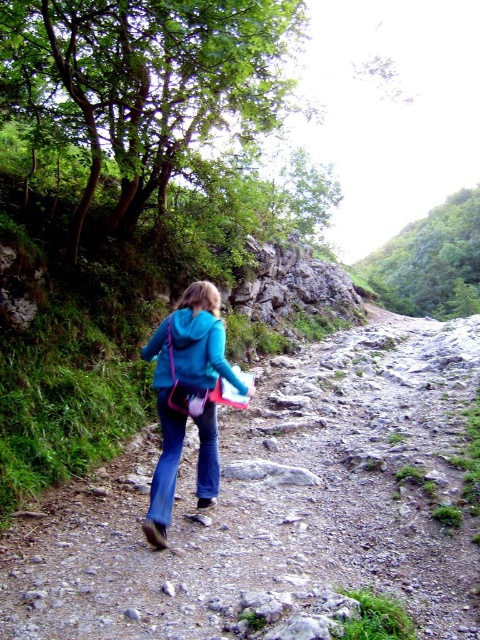
Question: Which object is farther from the camera taking this photo?

Choices:
 (A) matte blue jacket at center
 (B) teal matte jacket at center

Answer: (A)

Question: Does teal matte jacket at center have a lesser width compared to matte blue jacket at center?

Choices:
 (A) no
 (B) yes

Answer: (A)

Question: Which of the following is the closest to the observer?

Choices:
 (A) matte blue jacket at center
 (B) teal matte jacket at center

Answer: (B)

Question: Considering the real-world distances, which object is closest to the teal matte jacket at center?

Choices:
 (A) matte blue jacket at center
 (B) dusty gravel path at center

Answer: (A)

Question: Is dusty gravel path at center below matte blue jacket at center?

Choices:
 (A) yes
 (B) no

Answer: (A)

Question: Considering the relative positions of dusty gravel path at center and teal matte jacket at center in the image provided, where is dusty gravel path at center located with respect to teal matte jacket at center?

Choices:
 (A) below
 (B) above

Answer: (A)